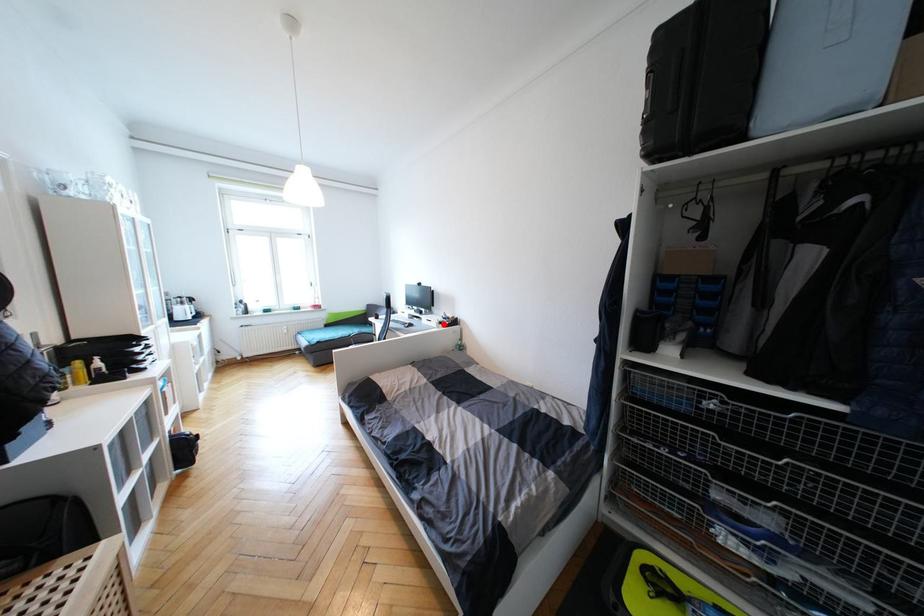
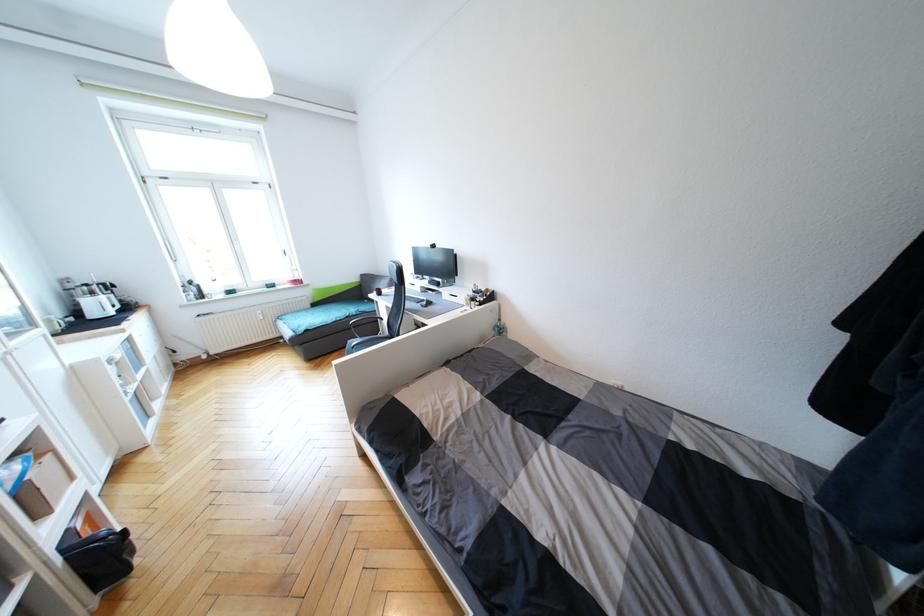
Where in the second image is the point corresponding to the highlighted location from the first image?

(476, 301)